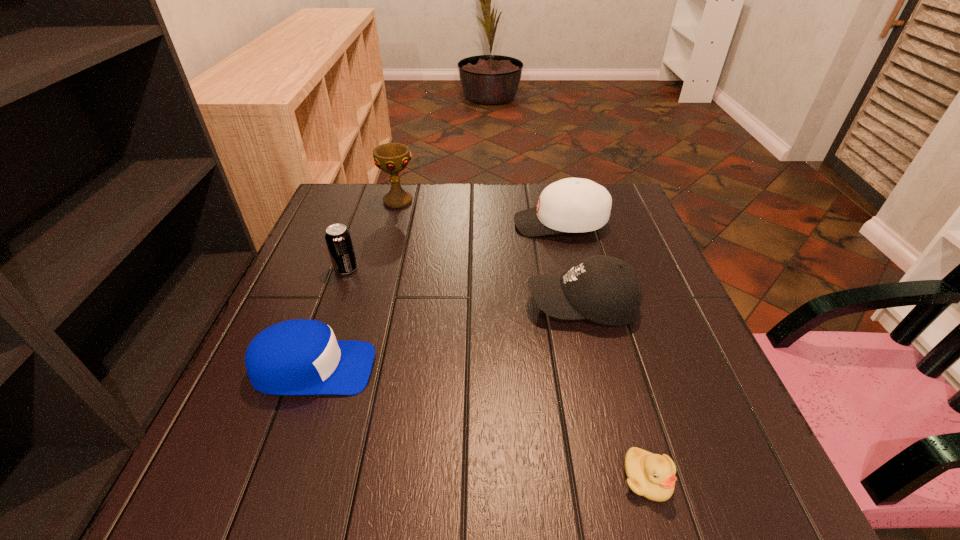
The image size is (960, 540). Find the location of `vacant point at the right edge`. vacant point at the right edge is located at coordinates (614, 242).

Where is `vacant area at the far left corner`? The width and height of the screenshot is (960, 540). vacant area at the far left corner is located at coordinates (354, 225).

In the image, there is a desktop. Where is `vacant space at the far right corner`? vacant space at the far right corner is located at coordinates (x=619, y=223).

Where is `free spot at the near right corner of the desktop`? free spot at the near right corner of the desktop is located at coordinates (713, 511).

Find the location of a particular element. This screenshot has width=960, height=540. vacant region between the chalice and the duckling is located at coordinates (522, 340).

Where is `blank region between the tallest object and the shortest object`? blank region between the tallest object and the shortest object is located at coordinates (522, 340).

Locate an element on the screen. This screenshot has height=540, width=960. unoccupied position between the fifth farthest object and the farthest baseball cap is located at coordinates (437, 296).

What are the coordinates of `unoccupied position between the third nearest object and the leftmost baseball cap` in the screenshot? It's located at tap(447, 337).

I want to click on vacant area that lies between the second nearest baseball cap and the farthest baseball cap, so click(x=571, y=264).

The width and height of the screenshot is (960, 540). I want to click on vacant space that's between the duckling and the farthest baseball cap, so click(604, 351).